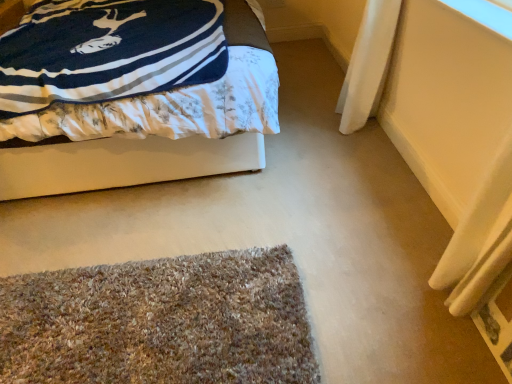
At what (x,y) coordinates should I click in order to perform the action: click on free space behind multicolored shaggy mat at lower center. Please return your answer as a coordinate pair (x, y). Looking at the image, I should click on (166, 213).